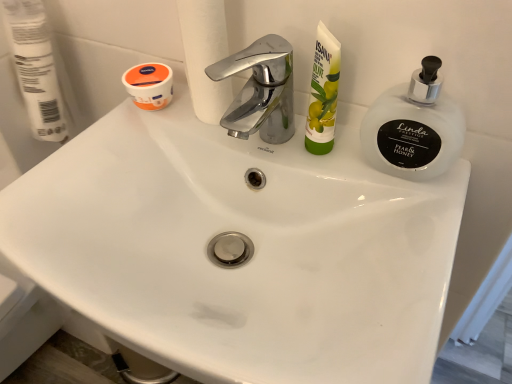
Image resolution: width=512 pixels, height=384 pixels. What are the coordinates of `orange matte jar at upper left` in the screenshot? It's located at (149, 85).

Describe the element at coordinates (205, 56) in the screenshot. I see `white matte toilet paper at upper center, the second toilet paper positioned from the left` at that location.

Where is `white matte toilet paper at upper left, which is counted as the first toilet paper, starting from the left`? white matte toilet paper at upper left, which is counted as the first toilet paper, starting from the left is located at coordinates (36, 68).

The width and height of the screenshot is (512, 384). What are the coordinates of `frosted glass soap dispenser at upper right` in the screenshot? It's located at (414, 127).

What do you see at coordinates (414, 127) in the screenshot?
I see `frosted glass soap dispenser at upper right` at bounding box center [414, 127].

Identify the location of orange matte jar at upper left. The height and width of the screenshot is (384, 512). point(149,85).

In the scene shown: Who is bigger, frosted glass soap dispenser at upper right or green matte tube at upper right?

frosted glass soap dispenser at upper right.

Do you think frosted glass soap dispenser at upper right is within green matte tube at upper right, or outside of it?

frosted glass soap dispenser at upper right is outside green matte tube at upper right.

Identify the location of toiletry behind the frosted glass soap dispenser at upper right. (323, 93).

Is white matte toilet paper at upper center, the second toilet paper positioned from the left, oriented away from green matte tube at upper right?

No.

Is white matte toilet paper at upper center, which ranks as the 1th toilet paper in right-to-left order, not close to green matte tube at upper right?

That's not correct — white matte toilet paper at upper center, which ranks as the 1th toilet paper in right-to-left order, is a little close to green matte tube at upper right.

This screenshot has height=384, width=512. There is a green matte tube at upper right. Identify the location of the 1st toilet paper above it (from the image's perspective). (205, 56).

Consider the image. In terms of size, does white matte toilet paper at upper center, the second toilet paper positioned from the left, appear bigger or smaller than green matte tube at upper right?

Considering their sizes, white matte toilet paper at upper center, the second toilet paper positioned from the left, takes up more space than green matte tube at upper right.

Considering the relative sizes of orange matte jar at upper left and white matte toilet paper at upper center, the second toilet paper positioned from the left, in the image provided, is orange matte jar at upper left bigger than white matte toilet paper at upper center, the second toilet paper positioned from the left,?

Actually, orange matte jar at upper left might be smaller than white matte toilet paper at upper center, the second toilet paper positioned from the left.

From the image's perspective, is orange matte jar at upper left above or below white matte toilet paper at upper center, which ranks as the 1th toilet paper in right-to-left order?

orange matte jar at upper left is situated lower than white matte toilet paper at upper center, which ranks as the 1th toilet paper in right-to-left order, in the image.

How many degrees apart are the facing directions of orange matte jar at upper left and white matte toilet paper at upper center, which ranks as the 1th toilet paper in right-to-left order?

There is a 0.954-degree angle between the facing directions of orange matte jar at upper left and white matte toilet paper at upper center, which ranks as the 1th toilet paper in right-to-left order.

How many degrees apart are the facing directions of white matte toilet paper at upper left, placed as the 2th toilet paper when sorted from right to left, and orange matte jar at upper left?

They differ by 88.3 degrees in their facing directions.

Consider the image. Which object is more forward, white matte toilet paper at upper left, which is counted as the first toilet paper, starting from the left, or orange matte jar at upper left?

white matte toilet paper at upper left, which is counted as the first toilet paper, starting from the left, is more forward.

At what (x,y) coordinates should I click in order to perform the action: click on mouthwash below the white matte toilet paper at upper left, placed as the 2th toilet paper when sorted from right to left (from the image's perspective). Please return your answer as a coordinate pair (x, y). The image size is (512, 384). Looking at the image, I should click on (149, 85).

From a real-world perspective, is white matte toilet paper at upper left, which is counted as the first toilet paper, starting from the left, on top of orange matte jar at upper left?

Yes, from a real-world perspective, white matte toilet paper at upper left, which is counted as the first toilet paper, starting from the left, is on top of orange matte jar at upper left.

Can frosted glass soap dispenser at upper right be found inside orange matte jar at upper left?

Actually, frosted glass soap dispenser at upper right is outside orange matte jar at upper left.

Is orange matte jar at upper left facing towards frosted glass soap dispenser at upper right?

No, orange matte jar at upper left is not facing towards frosted glass soap dispenser at upper right.

From the picture: From the image's perspective, is orange matte jar at upper left positioned above or below frosted glass soap dispenser at upper right?

Based on their image positions, orange matte jar at upper left is located above frosted glass soap dispenser at upper right.

Which of these two, orange matte jar at upper left or frosted glass soap dispenser at upper right, is wider?

With larger width is orange matte jar at upper left.

Between green matte tube at upper right and orange matte jar at upper left, which one appears on the left side from the viewer's perspective?

orange matte jar at upper left.

Is green matte tube at upper right not close to orange matte jar at upper left?

green matte tube at upper right is actually quite close to orange matte jar at upper left.

Considering the relative sizes of green matte tube at upper right and orange matte jar at upper left in the image provided, is green matte tube at upper right taller than orange matte jar at upper left?

Yes.

Does green matte tube at upper right have a lesser width compared to orange matte jar at upper left?

Yes.

Is point (29, 85) farther from camera compared to point (313, 141)?

That is True.

Find the location of a particular element. This screenshot has width=512, height=384. toiletry below the white matte toilet paper at upper left, placed as the 2th toilet paper when sorted from right to left (from the image's perspective) is located at coordinates (323, 93).

Based on the photo, from the image's perspective, is white matte toilet paper at upper left, placed as the 2th toilet paper when sorted from right to left, located beneath green matte tube at upper right?

No.

From a real-world perspective, is white matte toilet paper at upper left, which is counted as the first toilet paper, starting from the left, on green matte tube at upper right?

No, from a real-world perspective, white matte toilet paper at upper left, which is counted as the first toilet paper, starting from the left, is not over green matte tube at upper right

Locate an element on the screen. soap dispenser below the green matte tube at upper right (from a real-world perspective) is located at coordinates (414, 127).

You are a GUI agent. You are given a task and a screenshot of the screen. Output one action in this format:
    pyautogui.click(x=<x>, y=<y>)
    Task: Click on the toiletry that appears behind the white matte toilet paper at upper center, the second toilet paper positioned from the left
    
    Given the screenshot: What is the action you would take?
    pyautogui.click(x=323, y=93)

Based on their spatial positions, is orange matte jar at upper left or green matte tube at upper right closer to white matte toilet paper at upper center, which ranks as the 1th toilet paper in right-to-left order?

orange matte jar at upper left is closer to white matte toilet paper at upper center, which ranks as the 1th toilet paper in right-to-left order.

Considering their positions, is green matte tube at upper right positioned closer to white matte toilet paper at upper left, placed as the 2th toilet paper when sorted from right to left, than white matte toilet paper at upper center, which ranks as the 1th toilet paper in right-to-left order?

The object closer to white matte toilet paper at upper left, placed as the 2th toilet paper when sorted from right to left, is white matte toilet paper at upper center, which ranks as the 1th toilet paper in right-to-left order.

Looking at the image, which one is located closer to white matte toilet paper at upper left, placed as the 2th toilet paper when sorted from right to left, white matte toilet paper at upper center, which ranks as the 1th toilet paper in right-to-left order, or green matte tube at upper right?

white matte toilet paper at upper center, which ranks as the 1th toilet paper in right-to-left order, is positioned closer to the anchor white matte toilet paper at upper left, placed as the 2th toilet paper when sorted from right to left.

Looking at the image, which one is located further to frosted glass soap dispenser at upper right, green matte tube at upper right or white matte toilet paper at upper left, placed as the 2th toilet paper when sorted from right to left?

white matte toilet paper at upper left, placed as the 2th toilet paper when sorted from right to left.

Estimate the real-world distances between objects in this image. Which object is closer to green matte tube at upper right, white matte toilet paper at upper left, placed as the 2th toilet paper when sorted from right to left, or orange matte jar at upper left?

orange matte jar at upper left is positioned closer to the anchor green matte tube at upper right.

Considering their positions, is white matte toilet paper at upper left, placed as the 2th toilet paper when sorted from right to left, positioned further to white matte toilet paper at upper center, which ranks as the 1th toilet paper in right-to-left order, than green matte tube at upper right?

white matte toilet paper at upper left, placed as the 2th toilet paper when sorted from right to left, is further to white matte toilet paper at upper center, which ranks as the 1th toilet paper in right-to-left order.

Looking at this image, looking at the image, which one is located further to orange matte jar at upper left, white matte toilet paper at upper center, which ranks as the 1th toilet paper in right-to-left order, or green matte tube at upper right?

green matte tube at upper right is further to orange matte jar at upper left.

When comparing their distances from white matte toilet paper at upper left, which is counted as the first toilet paper, starting from the left, does orange matte jar at upper left or white matte toilet paper at upper center, which ranks as the 1th toilet paper in right-to-left order, seem closer?

Among the two, orange matte jar at upper left is located nearer to white matte toilet paper at upper left, which is counted as the first toilet paper, starting from the left.

The image size is (512, 384). In order to click on toiletry between orange matte jar at upper left and frosted glass soap dispenser at upper right from left to right in this screenshot , I will do `click(323, 93)`.

Locate an element on the screen. toilet paper located between white matte toilet paper at upper left, which is counted as the first toilet paper, starting from the left, and frosted glass soap dispenser at upper right in the left-right direction is located at coordinates (205, 56).

At what (x,y) coordinates should I click in order to perform the action: click on toiletry between white matte toilet paper at upper center, which ranks as the 1th toilet paper in right-to-left order, and frosted glass soap dispenser at upper right, in the horizontal direction. Please return your answer as a coordinate pair (x, y). This screenshot has height=384, width=512. Looking at the image, I should click on (323, 93).

The height and width of the screenshot is (384, 512). I want to click on toiletry between white matte toilet paper at upper left, which is counted as the first toilet paper, starting from the left, and frosted glass soap dispenser at upper right from left to right, so click(x=323, y=93).